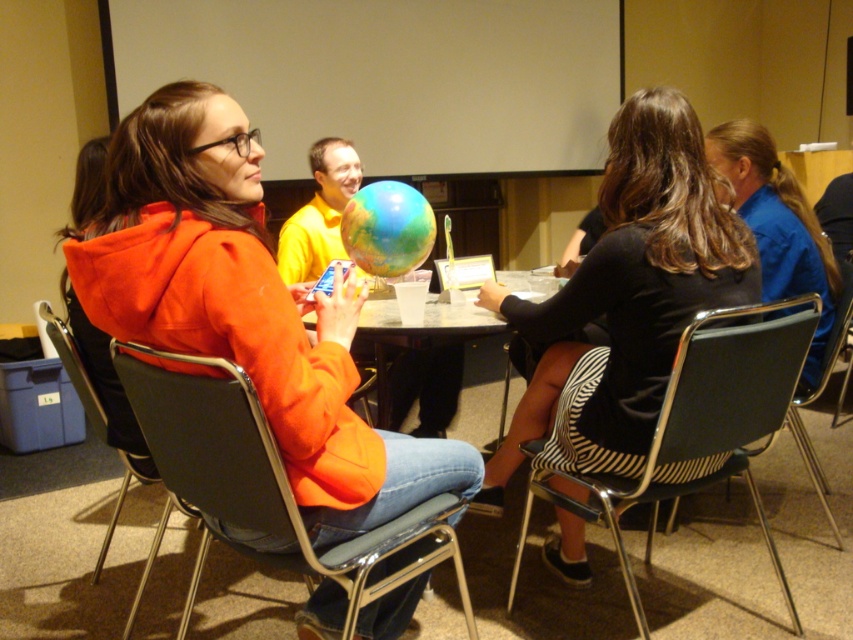
You are organizing a meeting for two people who need to sit at the table. You have a metallic gray chair at center and a black plastic chair at center. Which chair should you choose if you want to seat a taller person?

The black plastic chair at center is larger in size compared to the metallic gray chair at center, so it would be more suitable for seating a taller person.

You are standing in the conference room looking at the table with the globe. There are two points marked on the table. Which point is closer to you, point (x=824, y=236) or point (x=802, y=435)?

Point (x=824, y=236) is closer to the viewer than point (x=802, y=435).

Please look at the point marked at coordinates (x=778, y=227). What object or person is located there?

The blue fabric shirt at right is located at point (x=778, y=227).